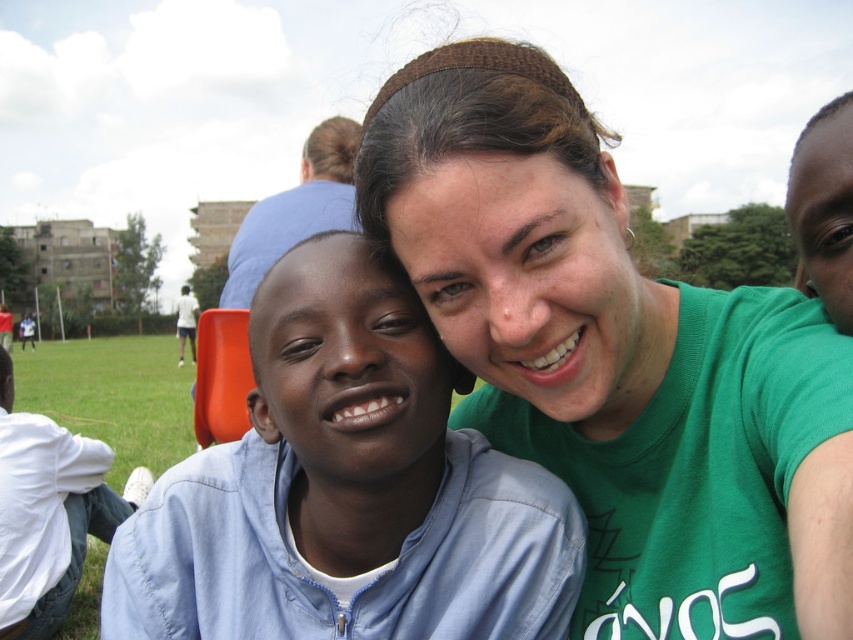
Question: Which point appears farthest from the camera in this image?

Choices:
 (A) (20, 433)
 (B) (456, 529)

Answer: (A)

Question: Which object is farther from the camera taking this photo?

Choices:
 (A) blue fabric shirt at center
 (B) light blue fabric shirt at center
 (C) green t-shirt at upper right

Answer: (A)

Question: In this image, where is white cotton shirt at lower left located relative to blue fabric shirt at center?

Choices:
 (A) right
 (B) left

Answer: (B)

Question: Is green t-shirt at upper right below blue fabric shirt at center?

Choices:
 (A) no
 (B) yes

Answer: (B)

Question: Is light blue fabric shirt at center smaller than blue fabric shirt at center?

Choices:
 (A) yes
 (B) no

Answer: (A)

Question: Which object is closer to the camera taking this photo?

Choices:
 (A) light blue fabric shirt at center
 (B) green t-shirt at upper right
 (C) blue fabric shirt at center

Answer: (B)